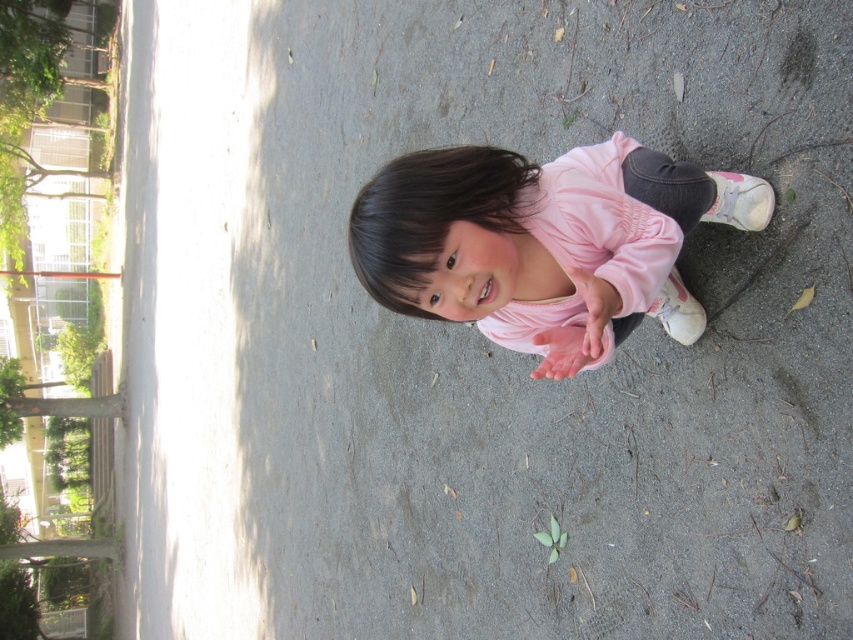
Question: Which point appears closest to the camera in this image?

Choices:
 (A) (515, 205)
 (B) (622, 225)

Answer: (B)

Question: Can you confirm if pink matte shirt at center is positioned below pink matte dress at center?

Choices:
 (A) yes
 (B) no

Answer: (A)

Question: Is pink matte shirt at center smaller than pink matte dress at center?

Choices:
 (A) no
 (B) yes

Answer: (A)

Question: Is pink matte shirt at center above pink matte dress at center?

Choices:
 (A) no
 (B) yes

Answer: (A)

Question: Which of the following is the closest to the observer?

Choices:
 (A) pink matte shirt at center
 (B) pink matte dress at center

Answer: (A)

Question: Which point is farther from the camera taking this photo?

Choices:
 (A) (656, 276)
 (B) (554, 280)

Answer: (B)